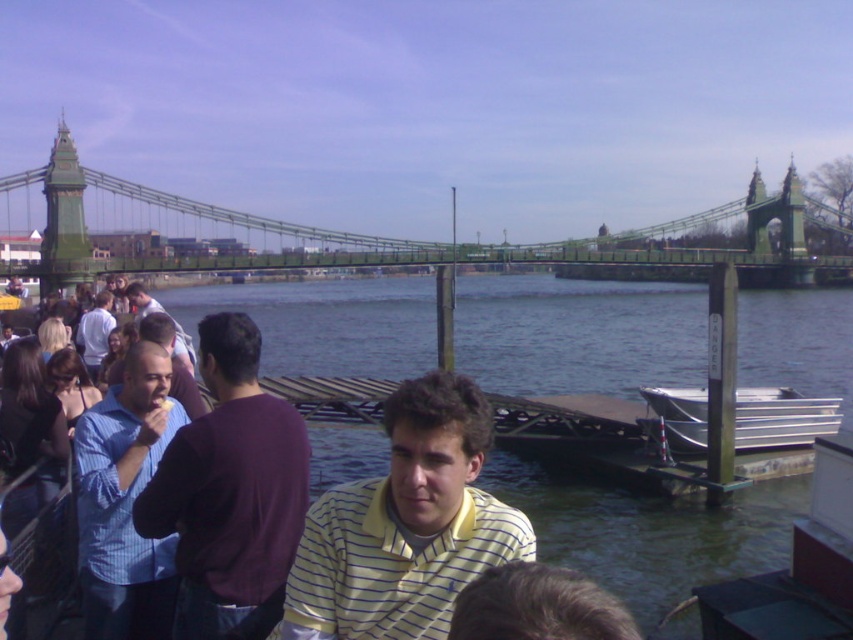
You are standing at the point labeled point (146, 586) and want to walk to the point labeled point (766, 428). Which direction should you move relative to the suspension bridge?

You should move away from the suspension bridge because point (146, 586) is in front of point (766, 428), meaning the latter is further back from the bridge.

You are standing at the riverside and want to take a photo of the blue striped shirt at left and the metallic silver boat at lower right without any obstructions. Is there any object between them that might block the view?

The blue striped shirt at left is in front of the metallic silver boat at lower right, so the shirt would block the view of the boat in the photo.